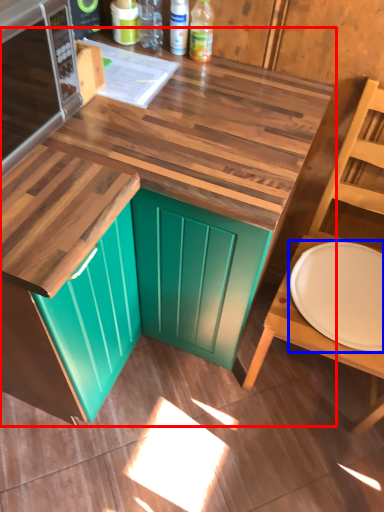
Question: Among these objects, which one is nearest to the camera, countertop (highlighted by a red box) or plate (highlighted by a blue box)?

Choices:
 (A) countertop
 (B) plate

Answer: (A)